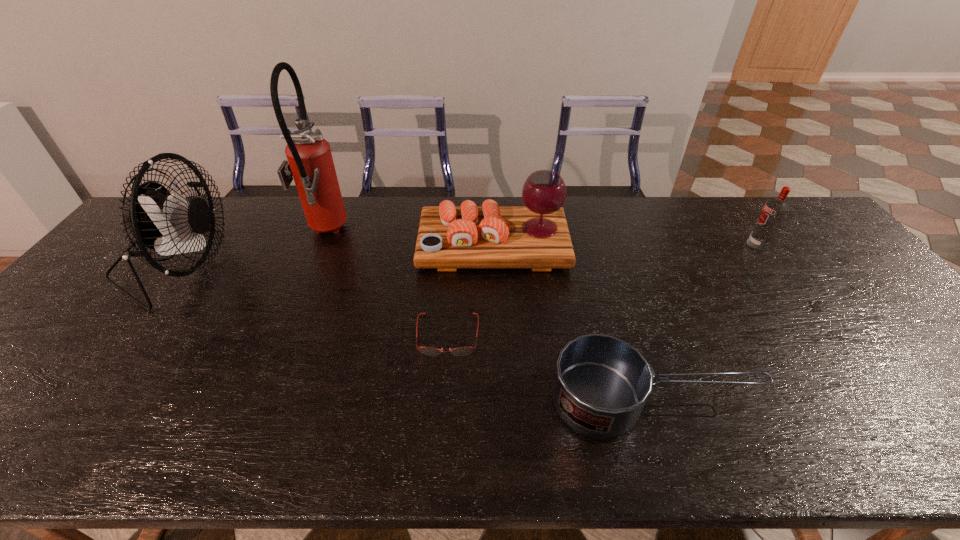
Image resolution: width=960 pixels, height=540 pixels. I want to click on free space located 0.210m in front of the second tallest object, directing airflow, so click(x=299, y=265).

Image resolution: width=960 pixels, height=540 pixels. In order to click on free region located 0.100m on the front of the platter in this screenshot , I will do `click(495, 299)`.

Identify the location of vacant region located on the front label of the rightmost object. This screenshot has height=540, width=960. (632, 244).

The width and height of the screenshot is (960, 540). Find the location of `vacant space located 0.270m on the front label of the rightmost object`. vacant space located 0.270m on the front label of the rightmost object is located at coordinates (660, 244).

Where is `vacant space located 0.270m on the front label of the rightmost object`? vacant space located 0.270m on the front label of the rightmost object is located at coordinates (660, 244).

Where is `blank area located with the handle extending from one side of the nearest object`? blank area located with the handle extending from one side of the nearest object is located at coordinates (841, 400).

What are the coordinates of `vacant space located on the lenses of the spectacles` in the screenshot? It's located at (444, 376).

This screenshot has height=540, width=960. In order to click on fire extinguisher situated at the far edge in this screenshot , I will do `click(310, 163)`.

Where is `fan situated at the far edge`? fan situated at the far edge is located at coordinates (158, 220).

You are a GUI agent. You are given a task and a screenshot of the screen. Output one action in this format:
    pyautogui.click(x=<x>, y=<y>)
    Task: Click on the platter that is at the far edge
    
    Given the screenshot: What is the action you would take?
    pyautogui.click(x=536, y=236)